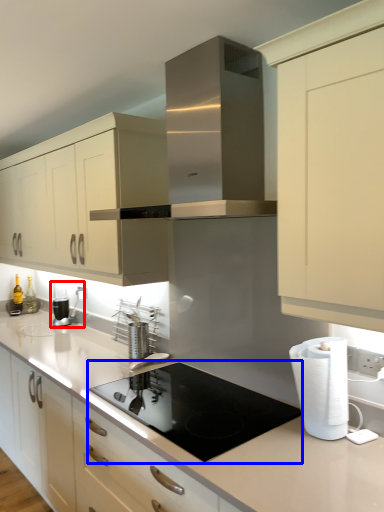
Question: Which object is further to the camera taking this photo, coffee machine (highlighted by a red box) or gas stove (highlighted by a blue box)?

Choices:
 (A) coffee machine
 (B) gas stove

Answer: (A)